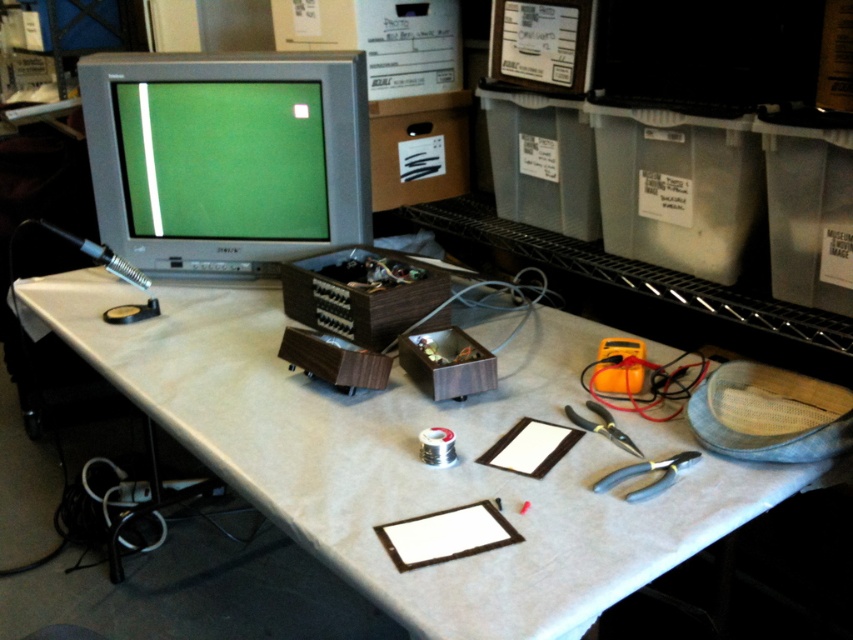
You are an electronics technician looking for your pliers. You see two pliers on the table. Which one is positioned lower on the table, the black plastic pliers at lower right or the black metal pliers at center?

The black plastic pliers at lower right is located below the black metal pliers at center, so it is positioned lower on the table.

You are standing in front of the workspace shown in the image. The matte gray monitor at upper left is part of your work area. If you need to reach an object that is 6 feet away from you, can you comfortably reach it from your current position without moving your feet?

The matte gray monitor at upper left is 5.50 feet away from the viewer. Since the object you need to reach is 6 feet away, which is slightly farther than the monitor, you might not be able to comfortably reach it without moving your feet.